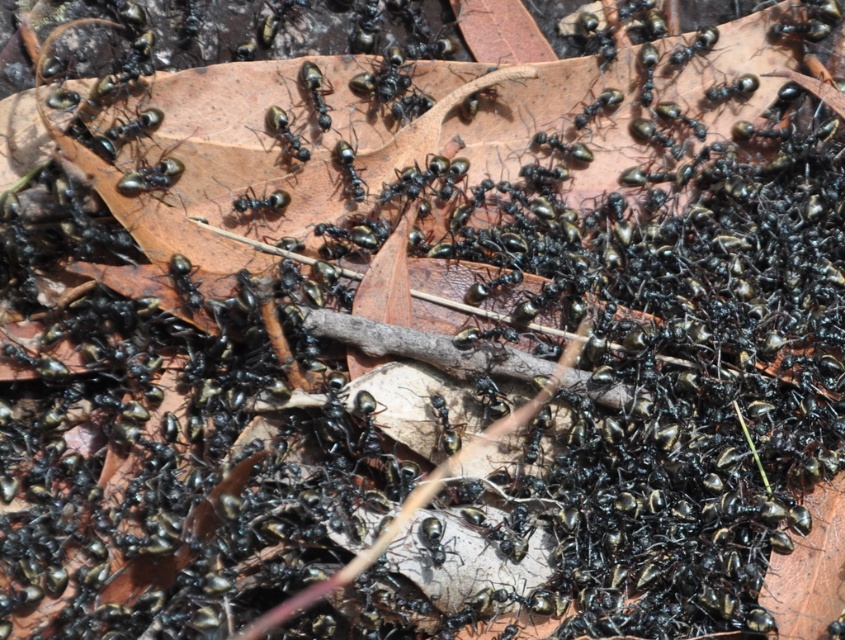
Question: Does shiny black ant at center appear on the right side of black shiny ant at center?

Choices:
 (A) no
 (B) yes

Answer: (A)

Question: Observing the image, what is the correct spatial positioning of shiny black ant at center in reference to black shiny ant at center?

Choices:
 (A) right
 (B) left

Answer: (B)

Question: Which of the following is the farthest from the observer?

Choices:
 (A) (262, 195)
 (B) (173, 160)

Answer: (A)

Question: Does shiny black ant at center lie behind black shiny ant at center?

Choices:
 (A) no
 (B) yes

Answer: (A)

Question: Which of the following is the farthest from the observer?

Choices:
 (A) black shiny ant at center
 (B) shiny black ant at center

Answer: (A)